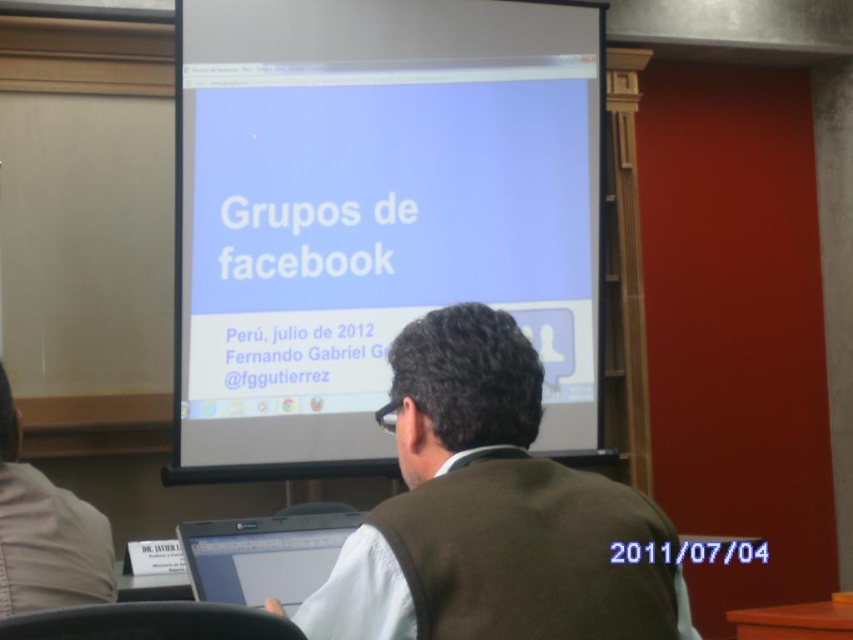
Question: Among these objects, which one is farthest from the camera?

Choices:
 (A) white glossy projector screen at center
 (B) silver metallic laptop at lower center
 (C) brown woolen vest at center

Answer: (A)

Question: Does white glossy projector screen at center have a larger size compared to brown woolen vest at center?

Choices:
 (A) no
 (B) yes

Answer: (B)

Question: Which object is farther from the camera taking this photo?

Choices:
 (A) brown woolen vest at center
 (B) white glossy projector screen at center

Answer: (B)

Question: Can you confirm if white glossy projector screen at center is positioned above brown woolen vest at center?

Choices:
 (A) yes
 (B) no

Answer: (A)

Question: Which point is farther to the camera?

Choices:
 (A) silver metallic laptop at lower center
 (B) brown woolen vest at center
 (C) white glossy projector screen at center

Answer: (C)

Question: Considering the relative positions of brown woolen vest at center and silver metallic laptop at lower center in the image provided, where is brown woolen vest at center located with respect to silver metallic laptop at lower center?

Choices:
 (A) right
 (B) left

Answer: (A)